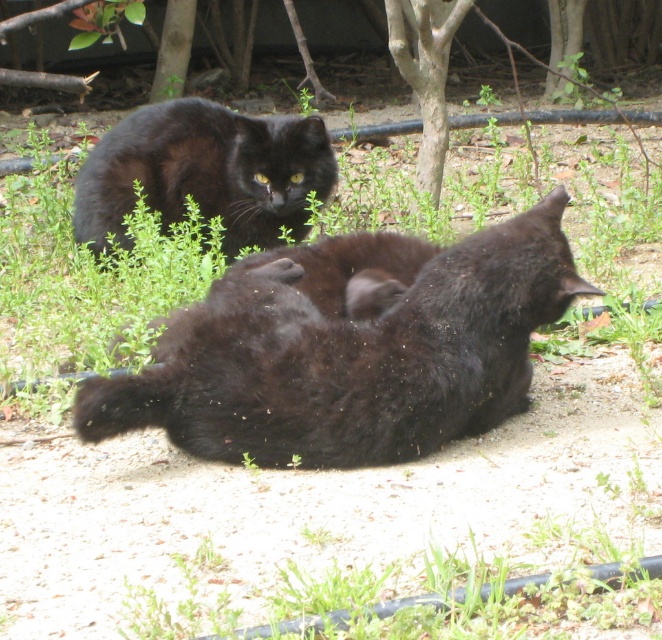
Does black fluffy cat at center have a smaller size compared to smooth bark tree at center?

No, black fluffy cat at center is not smaller than smooth bark tree at center.

Does black fluffy cat at center have a greater height compared to smooth bark tree at center?

No, black fluffy cat at center is not taller than smooth bark tree at center.

Image resolution: width=662 pixels, height=640 pixels. What do you see at coordinates (350, 356) in the screenshot?
I see `black fluffy cat at center` at bounding box center [350, 356].

Find the location of `black fluffy cat at center`. black fluffy cat at center is located at coordinates point(350,356).

Does black fluffy cat at center appear on the right side of shiny black cat at upper left?

Yes, black fluffy cat at center is to the right of shiny black cat at upper left.

Which is more to the left, black fluffy cat at center or shiny black cat at upper left?

shiny black cat at upper left is more to the left.

Where is `black fluffy cat at center`? Image resolution: width=662 pixels, height=640 pixels. black fluffy cat at center is located at coordinates (350, 356).

Measure the distance between shiny black cat at upper left and camera.

A distance of 4.16 meters exists between shiny black cat at upper left and camera.

Describe the element at coordinates (205, 172) in the screenshot. Image resolution: width=662 pixels, height=640 pixels. I see `shiny black cat at upper left` at that location.

Does point (120, 220) lie in front of point (442, 64)?

Yes, it is.

Where is `shiny black cat at upper left`? This screenshot has width=662, height=640. shiny black cat at upper left is located at coordinates (205, 172).